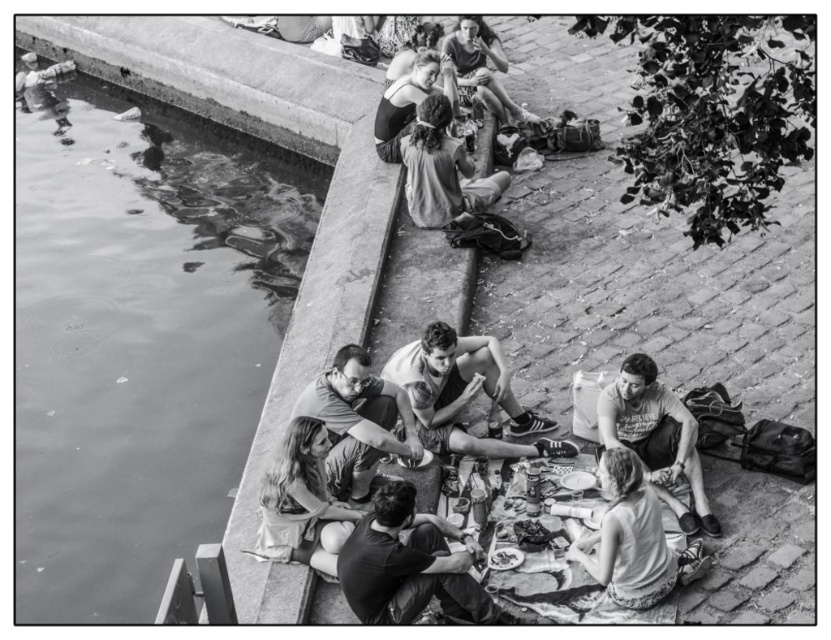
You are standing at the edge of the canal and want to walk to the picnic area. There are two points marked in the image. Which point, point (642, 604) or point (17, 76), is closer to you as you stand at the canal edge?

Point (642, 604) is closer to the viewer than point (17, 76), so the closer point is point (642, 604).